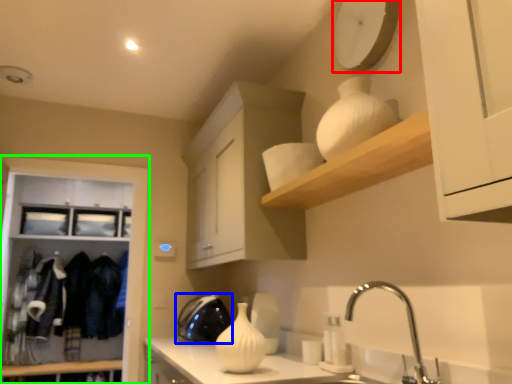
Question: Based on their relative distances, which object is farther from clock (highlighted by a red box)? Choose from appliance (highlighted by a blue box) and cabinetry (highlighted by a green box).

Choices:
 (A) appliance
 (B) cabinetry

Answer: (B)